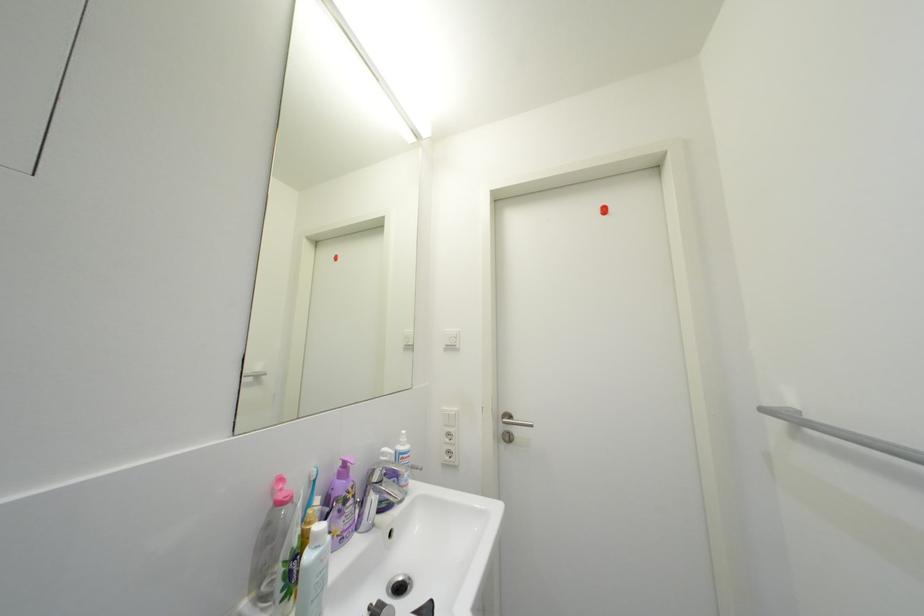
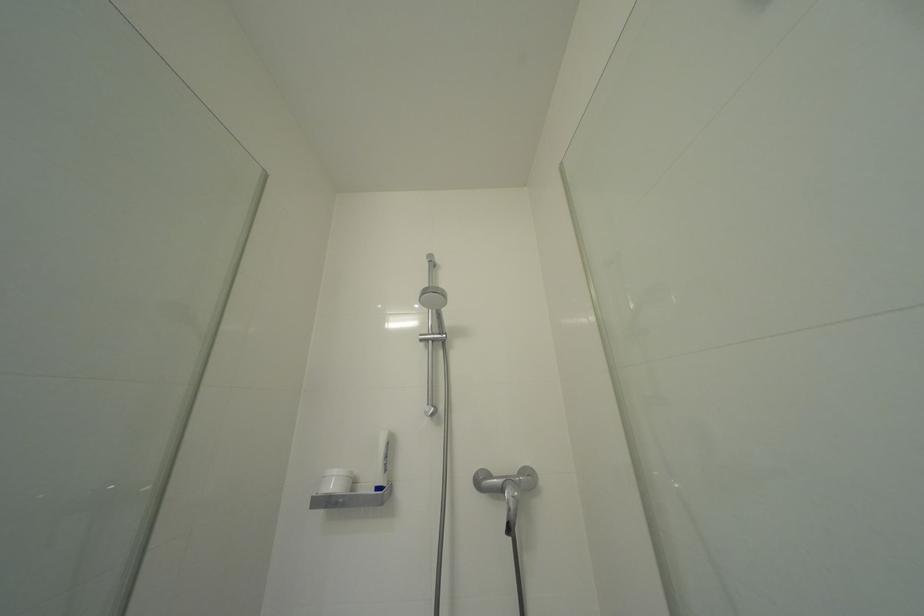
The first image is from the beginning of the video and the second image is from the end. How did the camera likely rotate when shooting the video?

The camera rotated toward right-up.